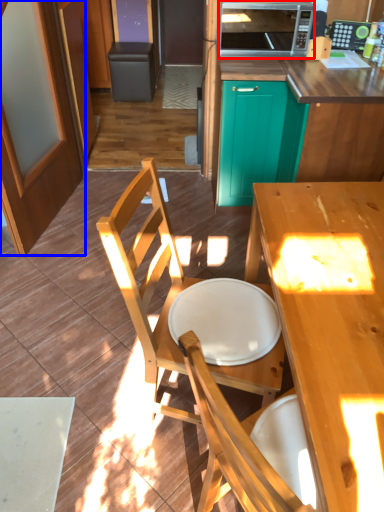
Question: Which object appears farthest to the camera in this image, microwave oven (highlighted by a red box) or screen door (highlighted by a blue box)?

Choices:
 (A) microwave oven
 (B) screen door

Answer: (A)